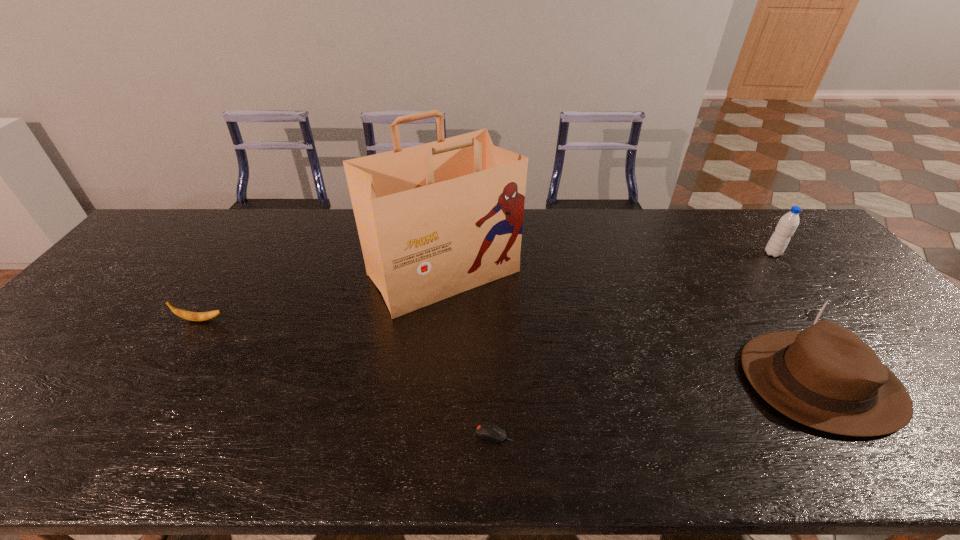
This screenshot has height=540, width=960. In order to click on empty space between the water bottle and the computer mouse in this screenshot , I will do `click(634, 343)`.

Where is `free space between the leftmost object and the water bottle`? The width and height of the screenshot is (960, 540). free space between the leftmost object and the water bottle is located at coordinates (487, 287).

Locate an element on the screen. This screenshot has height=540, width=960. vacant area that lies between the water bottle and the fedora is located at coordinates (797, 318).

I want to click on vacant area that lies between the banana and the fedora, so click(511, 351).

The height and width of the screenshot is (540, 960). Identify the location of empty space between the water bottle and the second shortest object. (487, 287).

Find the location of `free space that is in between the fedora and the water bottle`. free space that is in between the fedora and the water bottle is located at coordinates (797, 318).

What are the coordinates of `object that is the fourth closest to the grocery bag` in the screenshot? It's located at (788, 223).

Identify which object is the closest to the tallest object. Please provide its 2D coordinates. Your answer should be formatted as a tuple, i.e. [(x, y)], where the tuple contains the x and y coordinates of a point satisfying the conditions above.

[(486, 430)]

Locate an element on the screen. This screenshot has width=960, height=540. free space that satisfies the following two spatial constraints: 1. on the side of the tallest object with the superhero design; 2. on the peel of the banana from the top is located at coordinates (440, 320).

Identify the location of free spot that satisfies the following two spatial constraints: 1. on the side of the tallest object with the superhero design; 2. on the peel of the leftmost object from the top. (440, 320).